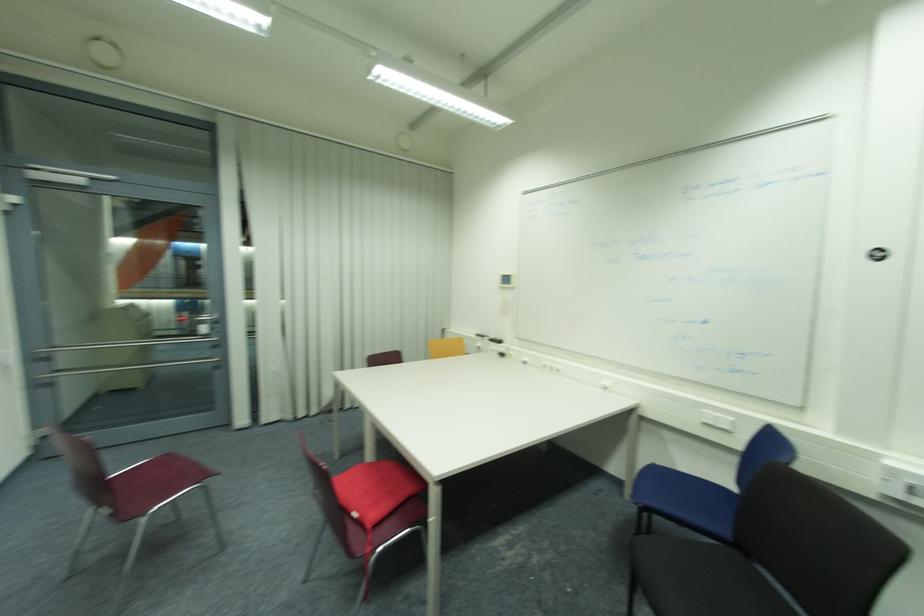
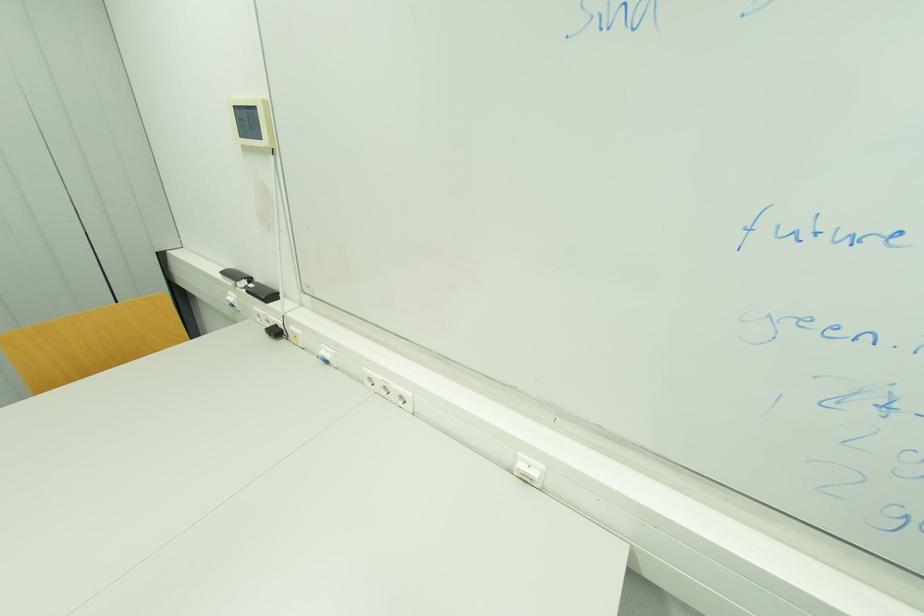
The point at (507,276) is marked in the first image. Where is the corresponding point in the second image?

(237, 108)